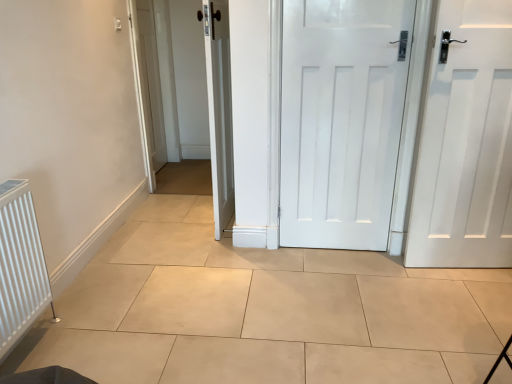
At what (x,y) coordinates should I click in order to perform the action: click on vacant region below white matte door at right, placed as the third door when sorted from left to right (from a real-world perspective). Please return your answer as a coordinate pair (x, y). Looking at the image, I should click on click(x=468, y=274).